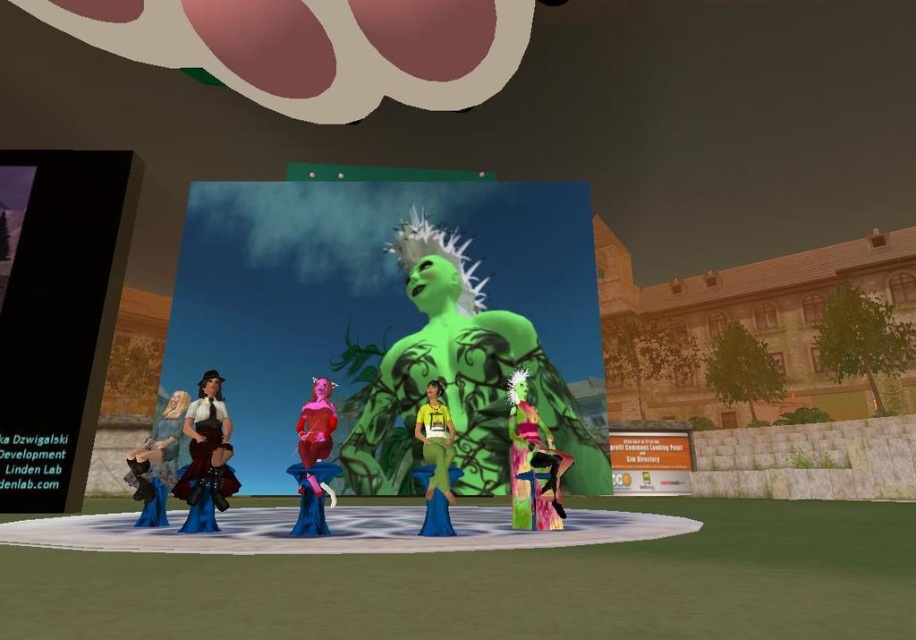
Question: Among these points, which one is farthest from the camera?

Choices:
 (A) (167, 477)
 (B) (315, 440)

Answer: (A)

Question: Does green matte statue at center appear on the left side of yellow matte dress at center?

Choices:
 (A) yes
 (B) no

Answer: (A)

Question: Considering the real-world distances, which object is closest to the yellow matte dress at center?

Choices:
 (A) matte brown leather vest at left
 (B) matte blue dress at lower left

Answer: (A)

Question: Considering the relative positions of green matte statue at center and matte brown leather vest at left in the image provided, where is green matte statue at center located with respect to matte brown leather vest at left?

Choices:
 (A) above
 (B) below

Answer: (A)

Question: Is matte blue dress at lower left wider than matte red devil at center?

Choices:
 (A) yes
 (B) no

Answer: (A)

Question: Which point is farther from the camera taking this photo?

Choices:
 (A) (511, 476)
 (B) (453, 435)
 (C) (328, 422)
 (D) (217, 454)

Answer: (A)